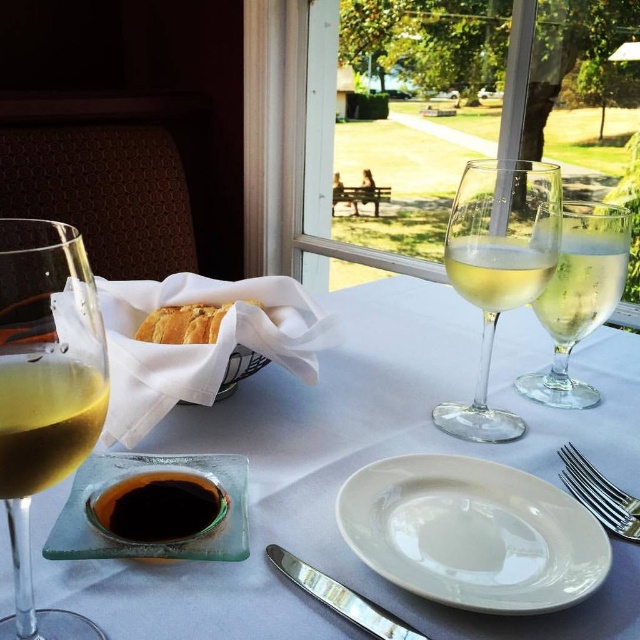
You are a waiter standing at the entrance of the restaurant and need to place a new wine glass exactly where the clear glass wine glass at center was. What are the coordinates where you should place the new glass?

The clear glass wine glass at center was located at coordinates (499,268), so you should place the new glass at those exact coordinates.

Based on the photo, you are a waiter carrying a tray and need to place a new drink between the transparent glass bowl at left and the clear glass wine glass at center. The tray is 6 inches wide. Can you fit the tray between them without moving either object?

The distance between the transparent glass bowl at left and the clear glass wine glass at center is 5.64 inches. Since the tray is 6 inches wide, it is slightly wider than the available space. Therefore, the tray cannot be placed between them without moving either object.

Based on the photo, you are a waiter at this restaurant and need to place a new menu on the table. The menu is 12 inches wide. There is space between the green grass at upper center and the polished metal knife at center. Can the menu fit in that space?

The green grass at upper center is wider than the polished metal knife at center. Since the menu is 12 inches wide, the space between them may or may not be sufficient. However, without exact measurements of the space itself, it is impossible to determine if the menu will fit.